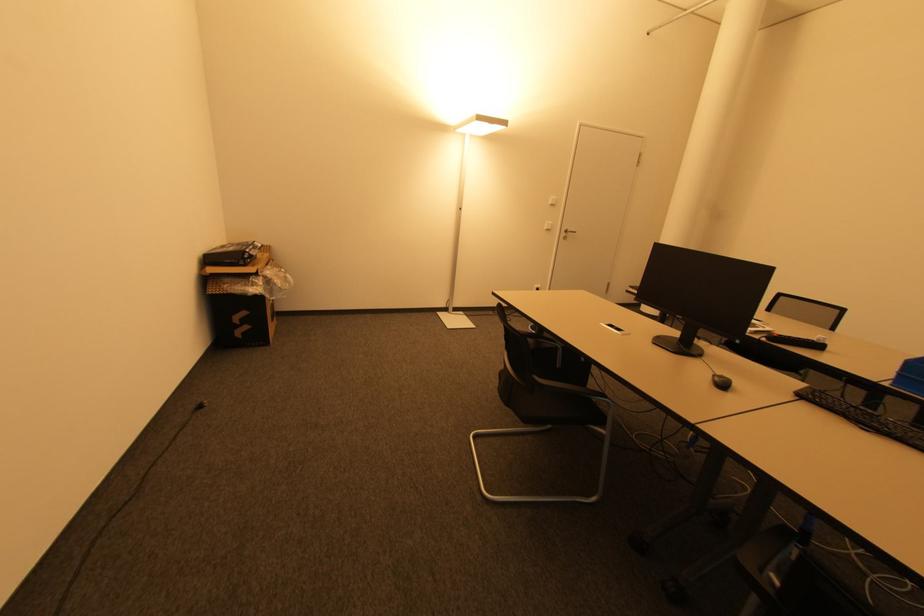
Describe the element at coordinates (239, 265) in the screenshot. I see `the brown cardboard box` at that location.